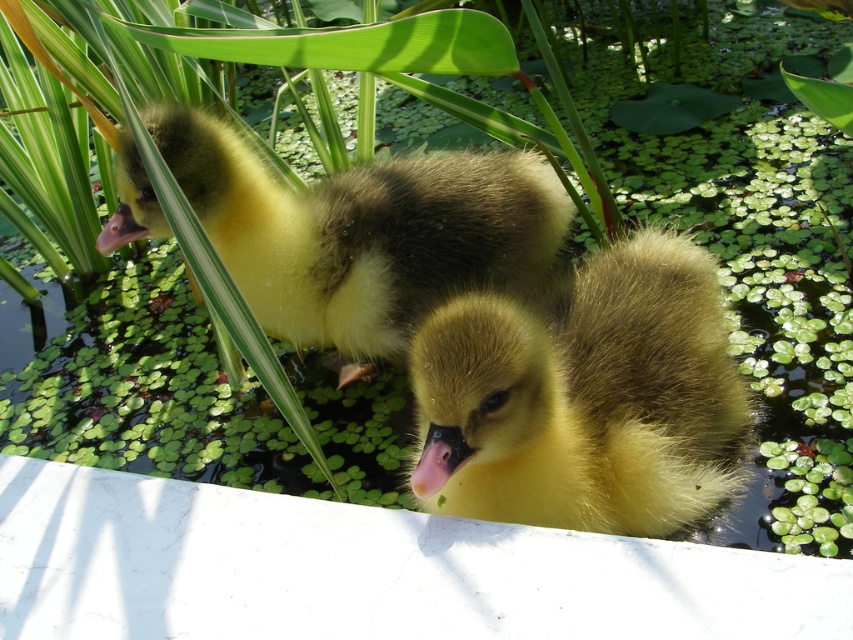
Question: Which point is closer to the camera?

Choices:
 (A) (515, 304)
 (B) (405, 269)

Answer: (A)

Question: Is the position of yellow fluffy duckling at center less distant than that of yellow downy duckling at center?

Choices:
 (A) no
 (B) yes

Answer: (B)

Question: Among these objects, which one is farthest from the camera?

Choices:
 (A) yellow downy duckling at center
 (B) yellow fluffy duckling at center

Answer: (A)

Question: Which point is closer to the camera?

Choices:
 (A) (97, 246)
 (B) (701, 408)

Answer: (B)

Question: Can you confirm if yellow fluffy duckling at center is smaller than yellow downy duckling at center?

Choices:
 (A) no
 (B) yes

Answer: (B)

Question: Can you confirm if yellow fluffy duckling at center is smaller than yellow downy duckling at center?

Choices:
 (A) yes
 (B) no

Answer: (A)